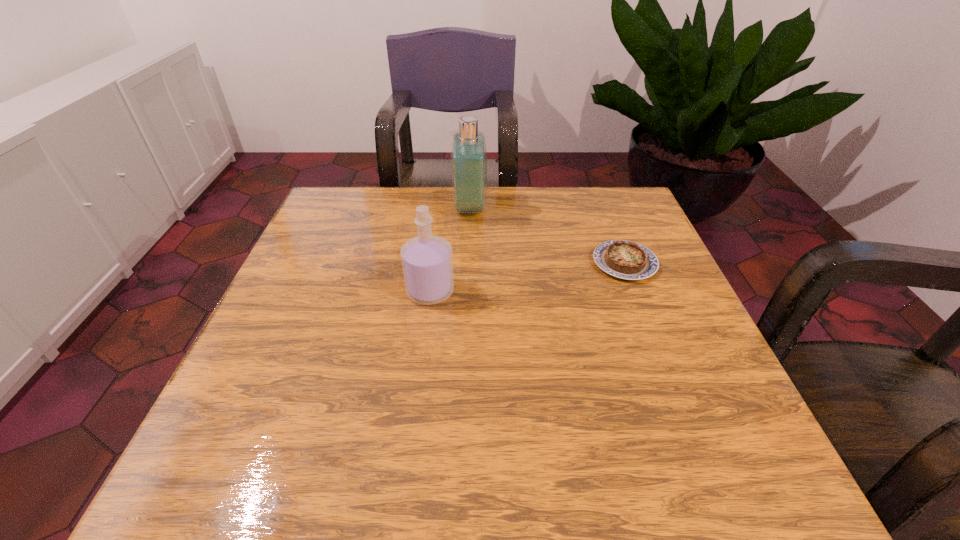
The width and height of the screenshot is (960, 540). Find the location of `free area in between the quiche and the second tallest object`. free area in between the quiche and the second tallest object is located at coordinates (527, 277).

At what (x,y) coordinates should I click in order to perform the action: click on free spot between the shortest object and the farther perfume. Please return your answer as a coordinate pair (x, y). Looking at the image, I should click on (547, 235).

Identify the location of vacant area that lies between the second tallest object and the shortest object. This screenshot has width=960, height=540. (527, 277).

Find the location of a particular element. Image resolution: width=960 pixels, height=540 pixels. object that is the second nearest to the shorter perfume is located at coordinates (623, 259).

Identify which object is the closest to the second tallest object. Please provide its 2D coordinates. Your answer should be formatted as a tuple, i.e. [(x, y)], where the tuple contains the x and y coordinates of a point satisfying the conditions above.

[(468, 153)]

I want to click on free region that satisfies the following two spatial constraints: 1. on the front label of the farther perfume; 2. on the right side of the shortest object, so click(468, 263).

Where is `free space that satisfies the following two spatial constraints: 1. on the front label of the farthest object; 2. on the back side of the quiche`? The image size is (960, 540). free space that satisfies the following two spatial constraints: 1. on the front label of the farthest object; 2. on the back side of the quiche is located at coordinates (468, 263).

Where is `free space in the image that satisfies the following two spatial constraints: 1. on the front label of the shortest object; 2. on the right side of the farther perfume`? Image resolution: width=960 pixels, height=540 pixels. free space in the image that satisfies the following two spatial constraints: 1. on the front label of the shortest object; 2. on the right side of the farther perfume is located at coordinates (468, 263).

Locate an element on the screen. This screenshot has height=540, width=960. vacant space that satisfies the following two spatial constraints: 1. on the front label of the farthest object; 2. on the right side of the quiche is located at coordinates (468, 263).

In order to click on free space in the image that satisfies the following two spatial constraints: 1. on the front label of the farthest object; 2. on the left side of the shortest object in this screenshot , I will do `click(468, 263)`.